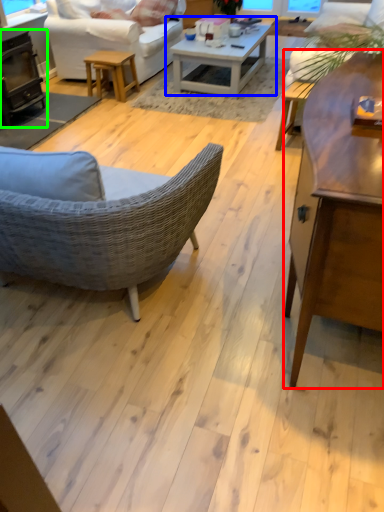
Question: Considering the real-world distances, which object is farthest from coffee table (highlighted by a red box)? coffee table (highlighted by a blue box) or fireplace (highlighted by a green box)?

Choices:
 (A) coffee table
 (B) fireplace

Answer: (B)